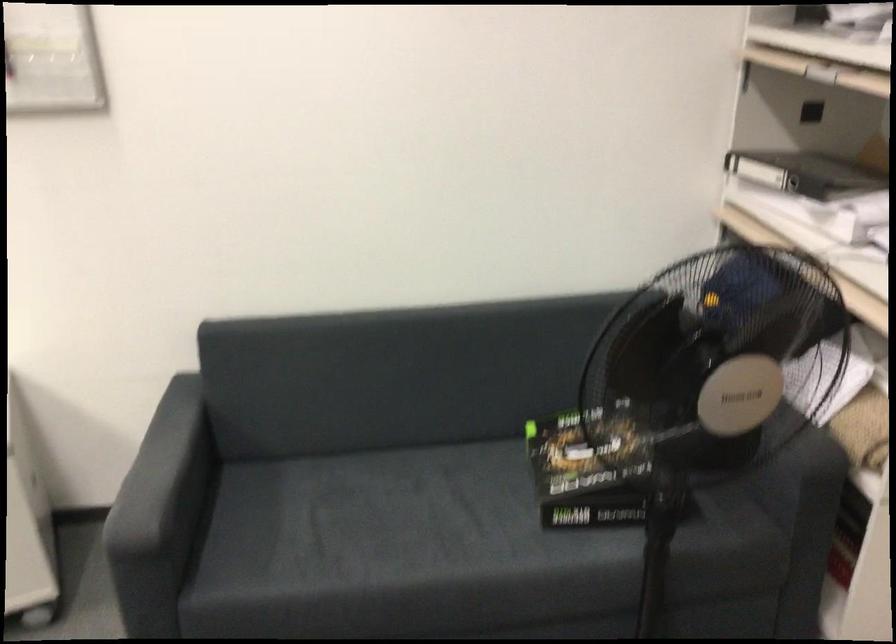
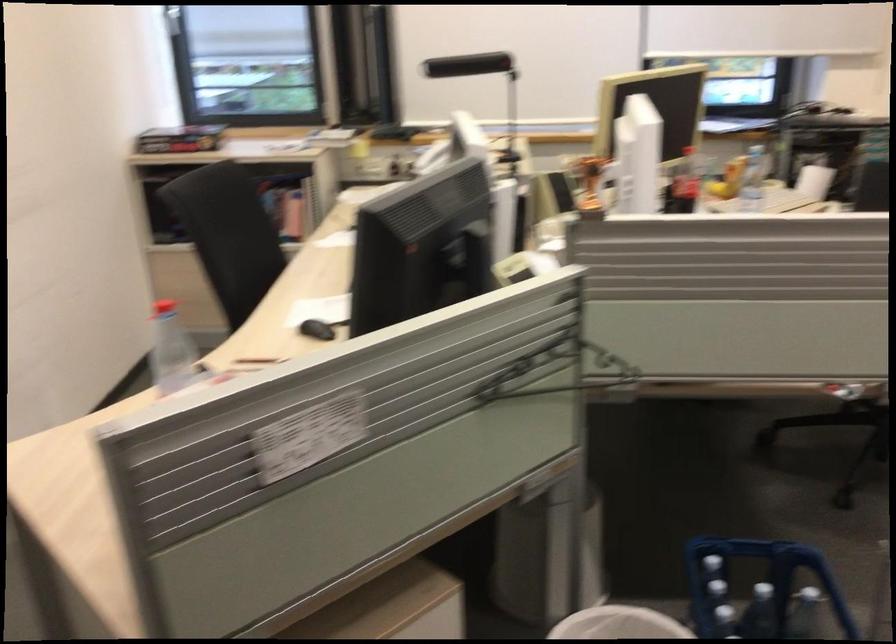
The images are taken continuously from a first-person perspective. In which direction is your viewpoint rotating?

The rotation direction of the camera is left-down.